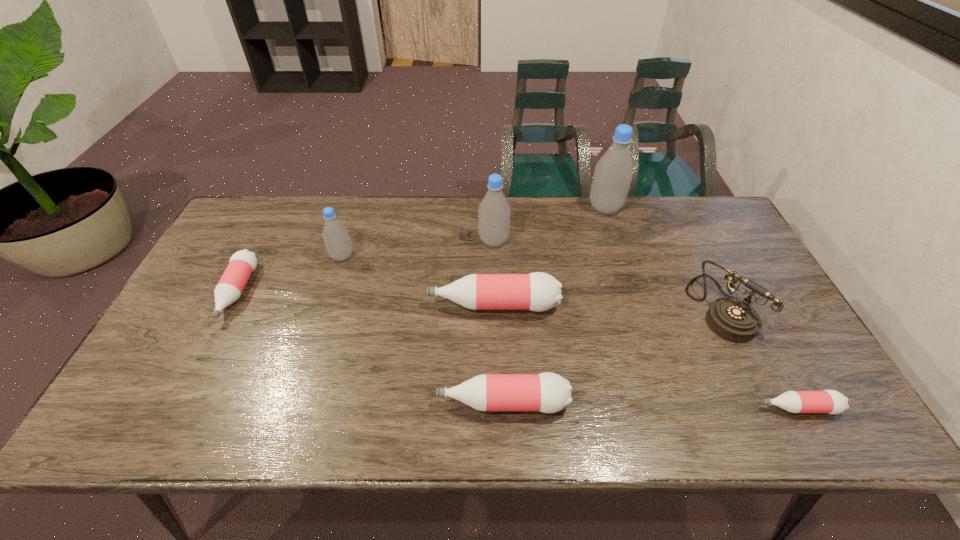
This screenshot has width=960, height=540. In order to click on the third smallest pink bottle in this screenshot , I will do `click(547, 392)`.

Identify the location of the leftmost pink bottle. (242, 263).

You are a GUI agent. You are given a task and a screenshot of the screen. Output one action in this format:
    pyautogui.click(x=<x>, y=<y>)
    Task: Click on the seventh tallest object
    
    Given the screenshot: What is the action you would take?
    pyautogui.click(x=242, y=263)

Locate an element on the screen. the shortest object is located at coordinates (827, 401).

Locate an element on the screen. This screenshot has height=540, width=960. the shortest bottle is located at coordinates (827, 401).

Locate an element on the screen. free region located 0.250m on the right of the farthest object is located at coordinates (695, 208).

You are a GUI agent. You are given a task and a screenshot of the screen. Output one action in this format:
    pyautogui.click(x=<x>, y=<y>)
    Task: Click on the vacant space located on the left of the sixth shortest bottle
    The height and width of the screenshot is (540, 960).
    Given the screenshot: What is the action you would take?
    pyautogui.click(x=441, y=241)

Where is `vacant space situated on the right of the smallest gray bottle`? vacant space situated on the right of the smallest gray bottle is located at coordinates (465, 256).

Where is `vacant area situated 0.230m on the back of the fifth shortest object`? The image size is (960, 540). vacant area situated 0.230m on the back of the fifth shortest object is located at coordinates (680, 225).

This screenshot has height=540, width=960. What are the coordinates of `blank area located with the cap open on the biggest pink bottle` in the screenshot? It's located at (384, 305).